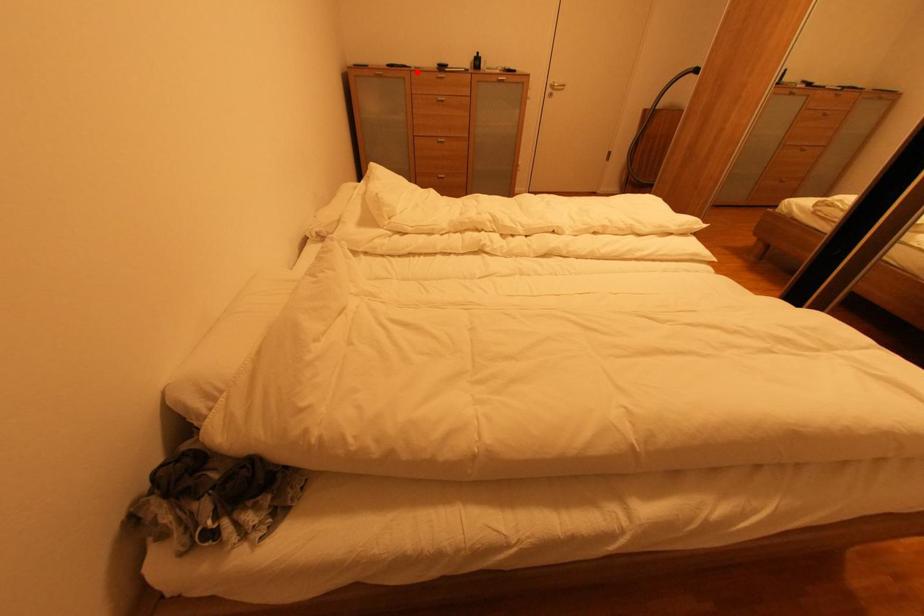
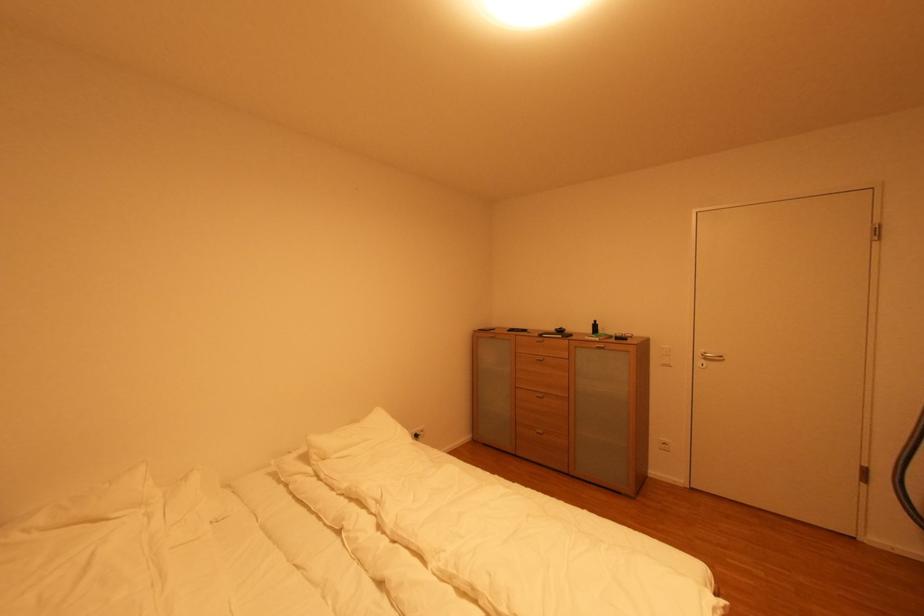
Question: I am providing you with two images of the same scene from different viewpoints. A red point is shown in image1. For the corresponding object point in image2, is it positioned nearer or farther from the camera?

Choices:
 (A) Nearer
 (B) Farther

Answer: (B)